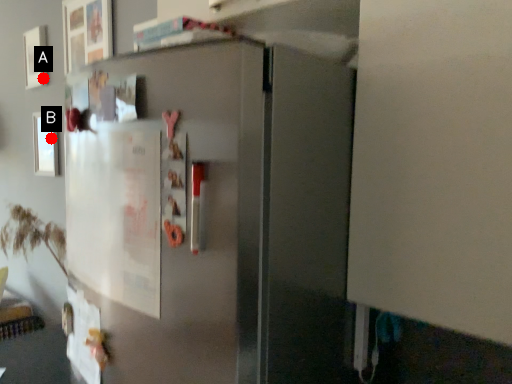
Question: Two points are circled on the image, labeled by A and B beside each circle. Which point is closer to the camera?

Choices:
 (A) A is closer
 (B) B is closer

Answer: (B)